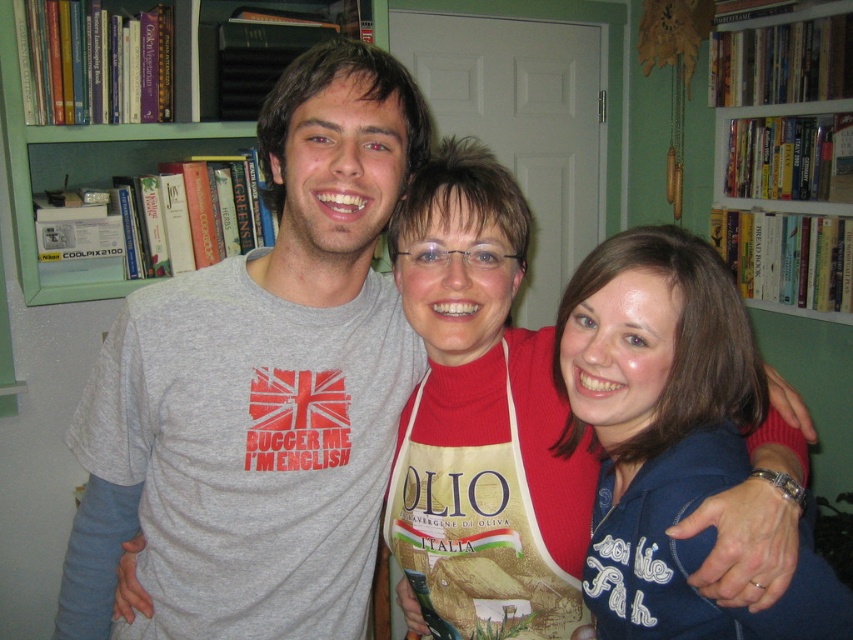
Question: Estimate the real-world distances between objects in this image. Which object is closer to the gray t-shirt at center?

Choices:
 (A) green wood bookcase at upper left
 (B) white wooden bookcase at upper center

Answer: (A)

Question: Among these objects, which one is farthest from the camera?

Choices:
 (A) apron made of fabric at center
 (B) gray t-shirt at center
 (C) green wood bookcase at upper left

Answer: (C)

Question: Among these objects, which one is farthest from the camera?

Choices:
 (A) apron made of fabric at center
 (B) white wooden bookcase at upper center
 (C) gray t-shirt at center
 (D) green wood bookcase at upper left

Answer: (B)

Question: Is the position of white wooden bookcase at upper center more distant than that of green wood bookcase at upper left?

Choices:
 (A) yes
 (B) no

Answer: (A)

Question: Is apron made of fabric at center thinner than white wooden bookcase at upper center?

Choices:
 (A) no
 (B) yes

Answer: (A)

Question: Is apron made of fabric at center smaller than green wood bookcase at upper left?

Choices:
 (A) yes
 (B) no

Answer: (B)